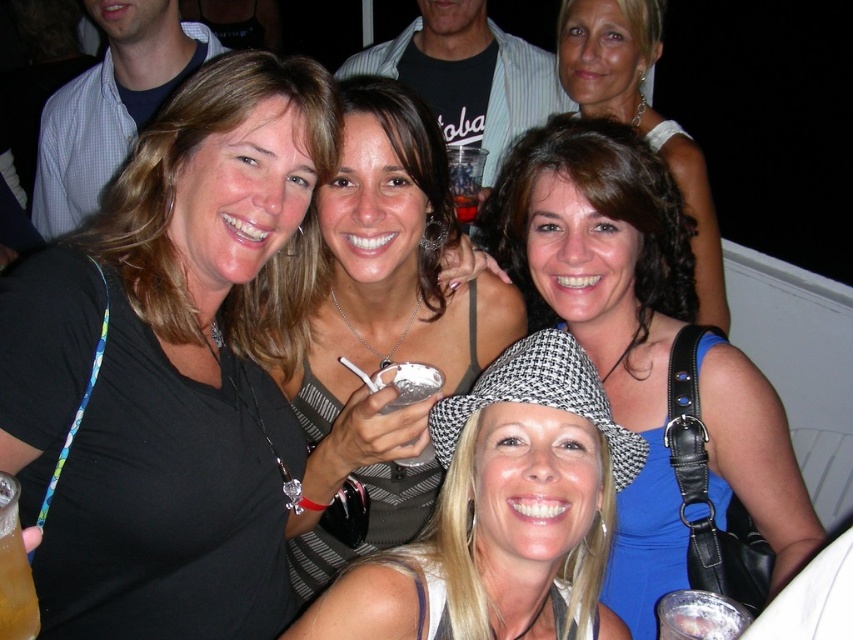
Based on the photo, you are standing in the center of the image and want to hand a gift to the person wearing the white textured hat at center. In which direction should you move to reach them?

The white textured hat at center is located at the center of the image, so you don not need to move in any direction to reach them.

You are at a party and want to take a photo of the white matte cupcake at center without the brown curly hair at center blocking it. How should you adjust your camera angle?

The brown curly hair at center is located above the white matte cupcake at center. To avoid the hair blocking the cupcake, you can lower your camera angle slightly so that the cupcake is framed below the hair.

You are a photographer at the event and need to ensure all subjects are in focus. Given that the brown curly hair at center and the white matte cupcake at center are both in the frame, which one is closer to the camera?

The brown curly hair at center is taller than the white matte cupcake at center, so it is closer to the camera.